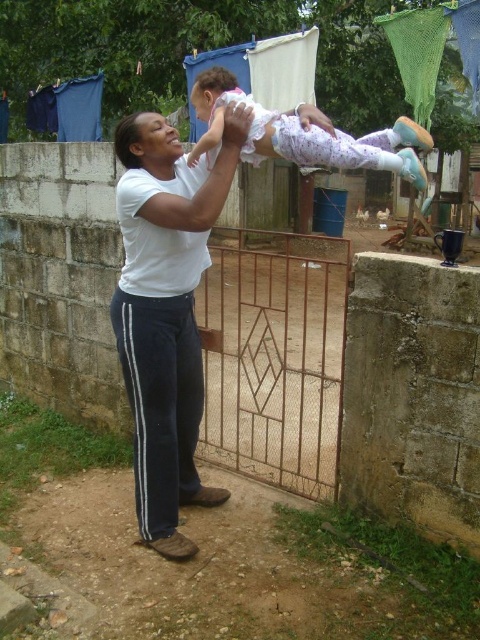
Based on the scene description, where is the white cotton shirt at center positioned relative to the metal gate with a geometric design?

The white cotton shirt at center is located at point (166, 312), which places it near the center of the image, while the metal gate is in the background. Therefore, the white cotton shirt at center is positioned in front of the metal gate with a geometric design.

You are a photographer trying to capture the scene where the woman and child are interacting. You want to ensure both the white cotton shirt at center and the white cotton baby at upper center are clearly visible in your photo. Based on their positions, which object should you focus on first to ensure depth of field captures both?

You should focus on the white cotton baby at upper center first because it is farther away from the camera than the white cotton shirt at center. By focusing on the farther object, the depth of field will include the closer object as well.